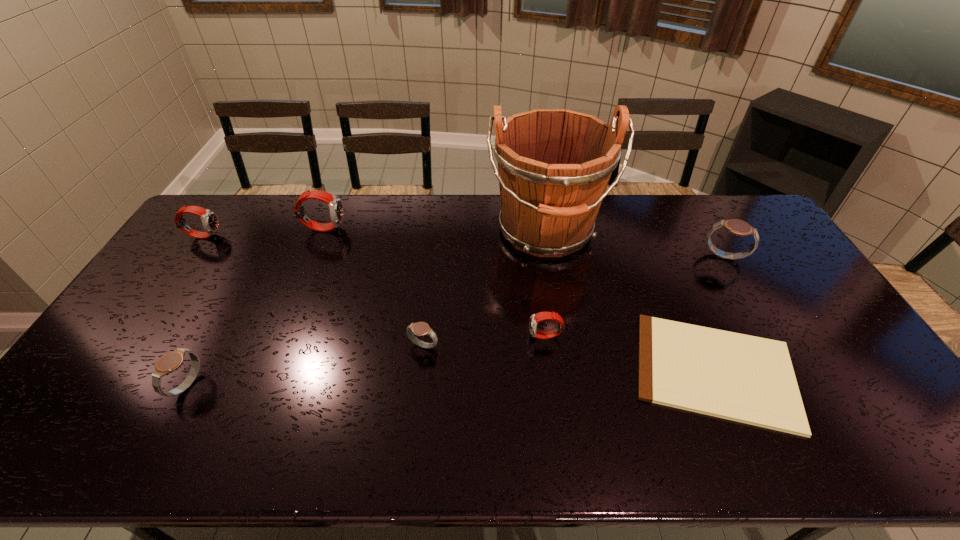
Find the location of a particular element. The image size is (960, 540). the smallest red watch is located at coordinates (535, 318).

Where is `the fifth object from right to left`? The width and height of the screenshot is (960, 540). the fifth object from right to left is located at coordinates (420, 328).

Locate an element on the screen. Image resolution: width=960 pixels, height=540 pixels. the smallest gray watch is located at coordinates (420, 328).

Locate an element on the screen. Image resolution: width=960 pixels, height=540 pixels. clipboard is located at coordinates (747, 379).

Find the location of a particular element. This screenshot has width=960, height=540. free point located 0.320m with the handle on the side of the bucket is located at coordinates (566, 357).

This screenshot has height=540, width=960. I want to click on vacant region located 0.130m on the face of the third object from left to right, so click(x=381, y=227).

Identify the location of vacant space positioned on the left of the farthest gray watch. This screenshot has width=960, height=540. (x=684, y=257).

At what (x,y) coordinates should I click in order to perform the action: click on vacant space located 0.170m on the face of the leftmost object. Please return your answer as a coordinate pair (x, y). The width and height of the screenshot is (960, 540). Looking at the image, I should click on (269, 235).

This screenshot has width=960, height=540. What are the coordinates of `free location located on the right of the fifth watch from right to left` in the screenshot? It's located at (303, 386).

Find the location of a particular element. free space located on the face of the fifth watch from left to right is located at coordinates (504, 336).